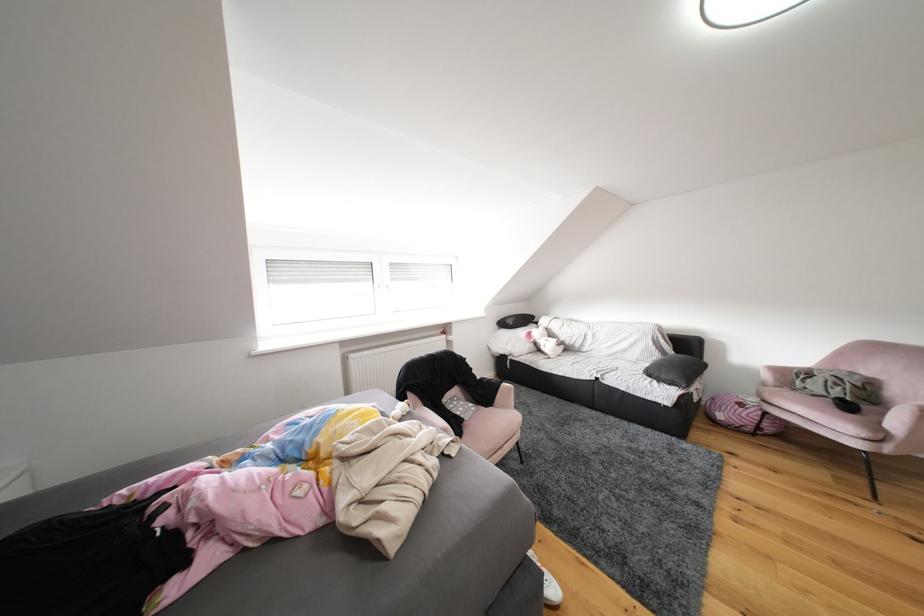
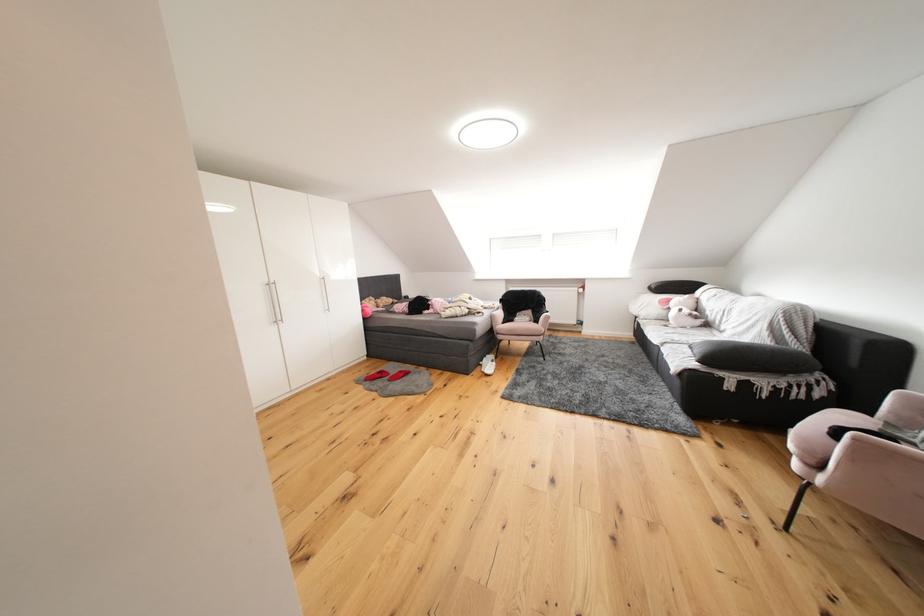
In the second image, find the point that corresponds to [539,338] in the first image.

(677, 305)